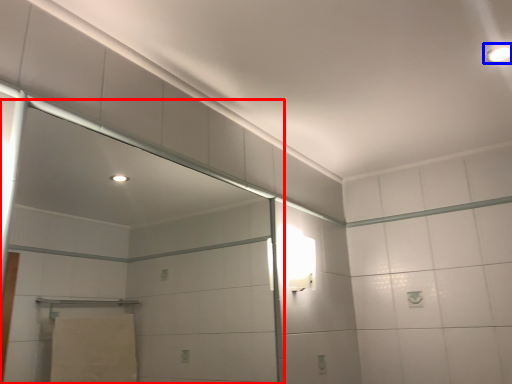
Question: Which point is further to the camera, screen door (highlighted by a red box) or light fixture (highlighted by a blue box)?

Choices:
 (A) screen door
 (B) light fixture

Answer: (B)